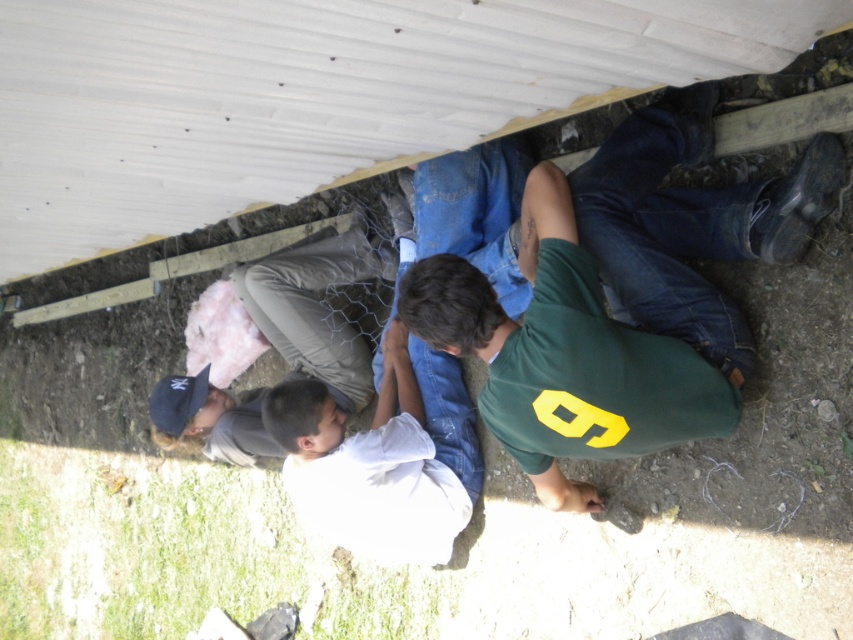
Question: Can you confirm if green jersey at center is positioned above white cotton shirt at center?

Choices:
 (A) yes
 (B) no

Answer: (A)

Question: Considering the relative positions of green jersey at center and white cotton shirt at center in the image provided, where is green jersey at center located with respect to white cotton shirt at center?

Choices:
 (A) left
 (B) right

Answer: (B)

Question: Is green jersey at center below white cotton shirt at center?

Choices:
 (A) yes
 (B) no

Answer: (B)

Question: Among these points, which one is nearest to the camera?

Choices:
 (A) (450, 467)
 (B) (753, 250)

Answer: (B)

Question: Which of the following is the farthest from the observer?

Choices:
 (A) green jersey at center
 (B) white cotton shirt at center

Answer: (B)